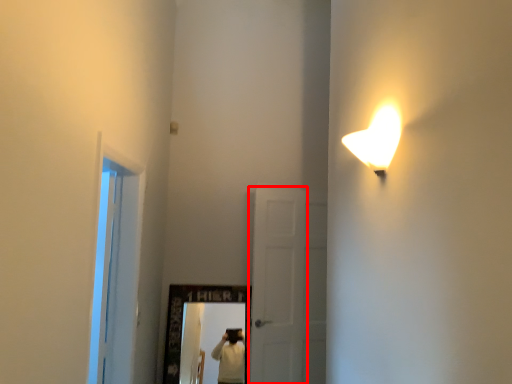
Question: Observing the image, what is the correct spatial positioning of door (annotated by the red box) in reference to window?

Choices:
 (A) right
 (B) left

Answer: (A)